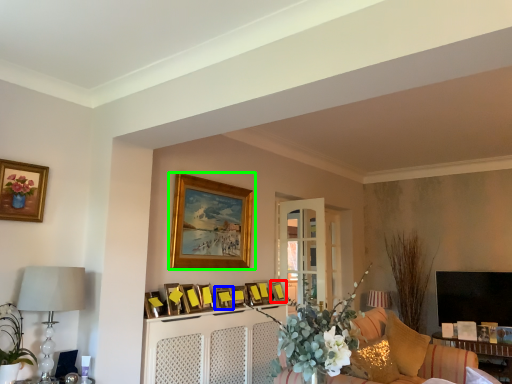
Question: Which is farther away from picture frame (highlighted by a red box)? picture frame (highlighted by a blue box) or picture frame (highlighted by a green box)?

Choices:
 (A) picture frame
 (B) picture frame

Answer: (B)